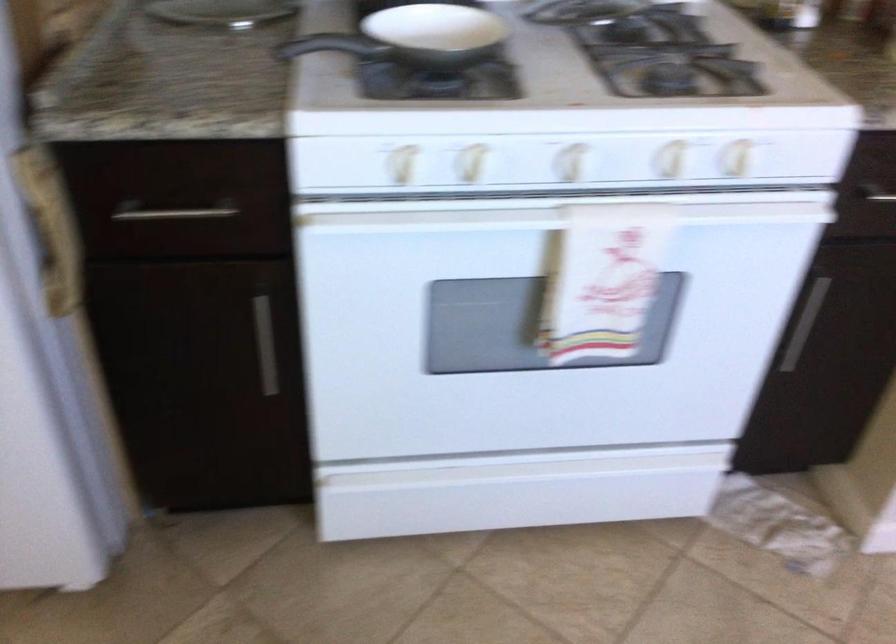
Where would you lift the small white bowl? Please return your answer as a coordinate pair (x, y).

(436, 33)